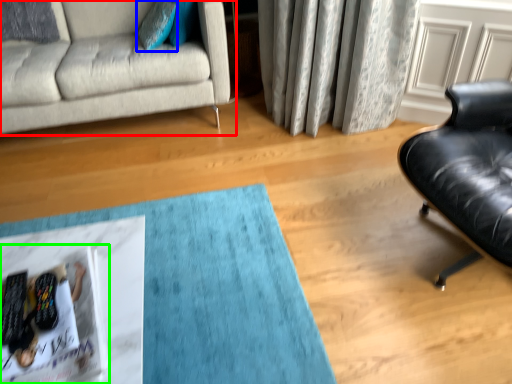
Question: Based on their relative distances, which object is farther from studio couch (highlighted by a red box)? Choose from pillow (highlighted by a blue box) and magazine (highlighted by a green box).

Choices:
 (A) pillow
 (B) magazine

Answer: (B)